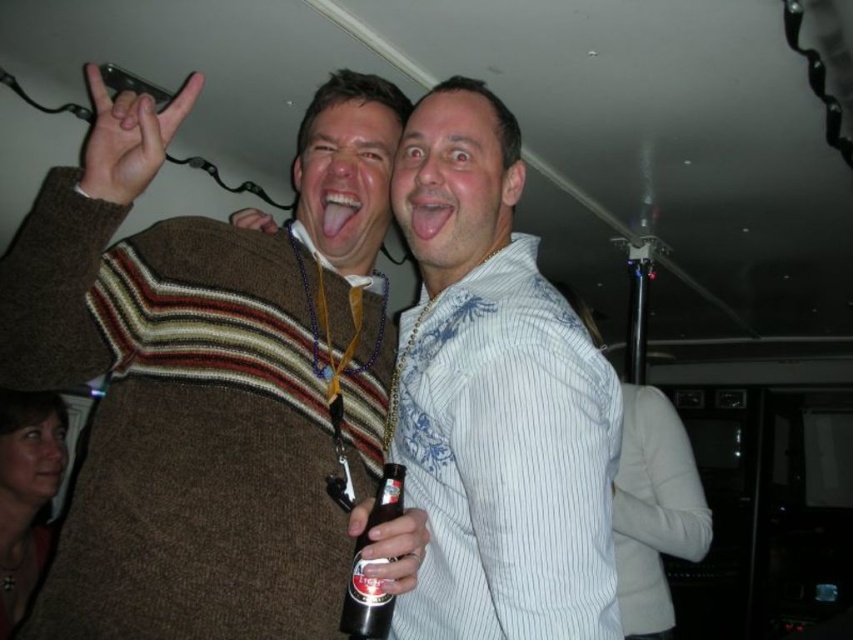
Can you confirm if white striped shirt at center is positioned above matte black beer bottle at center?

Indeed, white striped shirt at center is positioned over matte black beer bottle at center.

From the picture: Can you confirm if white striped shirt at center is bigger than matte black beer bottle at center?

Correct, white striped shirt at center is larger in size than matte black beer bottle at center.

Who is more distant from viewer, [456,486] or [367,499]?

Positioned behind is point [367,499].

Identify the location of white striped shirt at center. This screenshot has height=640, width=853. (495, 397).

Can you confirm if black glass bottle at center is thinner than brown fuzzy sweater at upper center?

Yes.

Which is in front, point (349, 586) or point (230, 224)?

Point (349, 586) is in front.

Does point (352, 577) come in front of point (263, 228)?

Yes, it is.

At what (x,y) coordinates should I click in order to perform the action: click on black glass bottle at center. Please return your answer as a coordinate pair (x, y). This screenshot has height=640, width=853. Looking at the image, I should click on (368, 563).

Is matte brown hand at upper left to the left of black glass bottle at center from the viewer's perspective?

Correct, you'll find matte brown hand at upper left to the left of black glass bottle at center.

Does matte brown hand at upper left appear under black glass bottle at center?

No.

Is point (131, 154) closer to viewer compared to point (341, 620)?

Yes, it is.

What are the coordinates of `matte brown hand at upper left` in the screenshot? It's located at (128, 138).